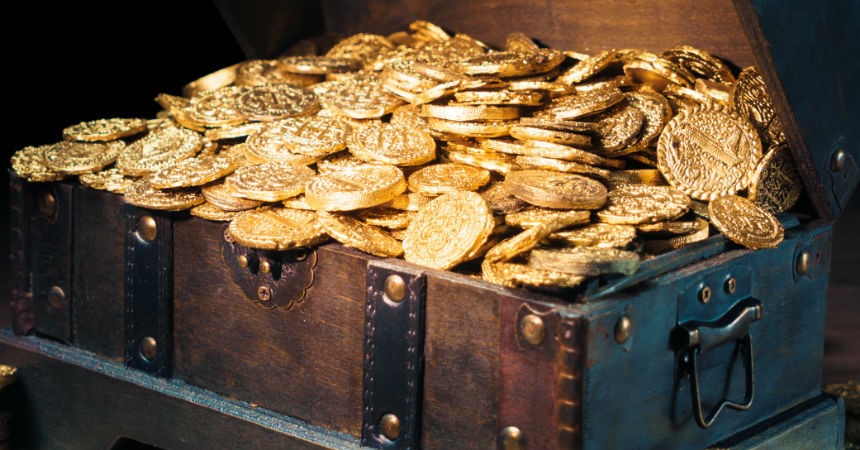
Locate an element on the screen. brass trunk handle is located at coordinates [x=728, y=337].